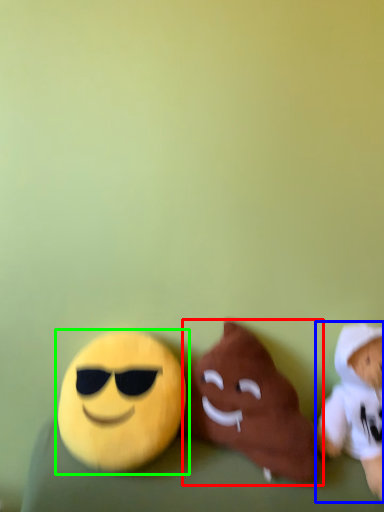
Question: Which object is the closest to the toy (highlighted by a red box)? Choose among these: toy (highlighted by a blue box) or toy (highlighted by a green box).

Choices:
 (A) toy
 (B) toy

Answer: (B)